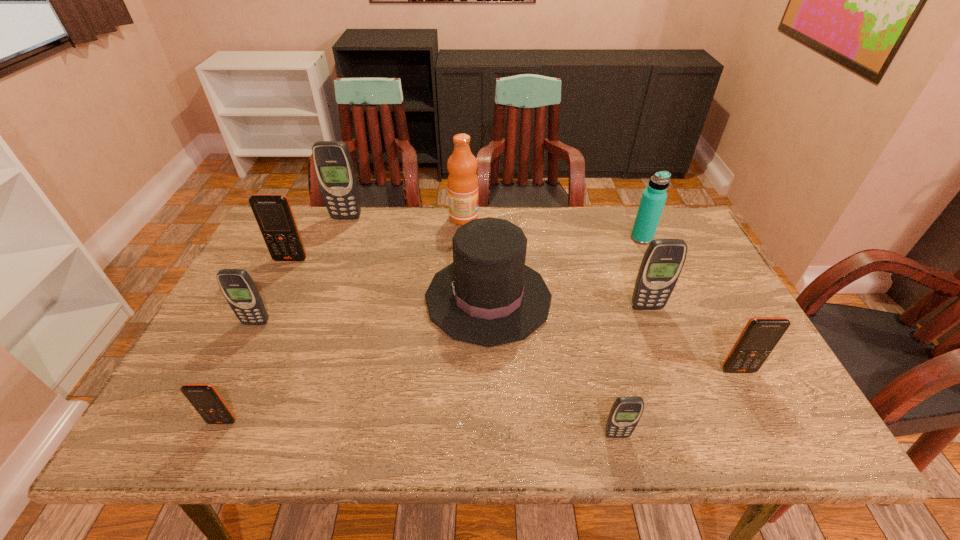
Locate an element on the screen. water bottle that is at the far edge is located at coordinates (653, 199).

Find the location of a particular element. This screenshot has height=540, width=960. water bottle present at the right edge is located at coordinates (653, 199).

I want to click on cellular telephone present at the right edge, so click(760, 336).

At what (x,y) coordinates should I click in order to perform the action: click on object that is positioned at the near left corner. Please return your answer as a coordinate pair (x, y). Looking at the image, I should click on (204, 397).

Locate an element on the screen. This screenshot has height=540, width=960. object at the far right corner is located at coordinates (653, 199).

The height and width of the screenshot is (540, 960). I want to click on free space at the far edge of the desktop, so click(x=371, y=214).

The image size is (960, 540). I want to click on vacant area at the near edge of the desktop, so click(x=455, y=410).

The width and height of the screenshot is (960, 540). I want to click on vacant space at the left edge, so click(x=278, y=308).

The width and height of the screenshot is (960, 540). In the image, there is a desktop. What are the coordinates of `vacant space at the right edge` in the screenshot? It's located at (715, 377).

Locate an element on the screen. The height and width of the screenshot is (540, 960). empty space between the fifth farthest cellular telephone and the rightmost gray cellular telephone is located at coordinates (692, 339).